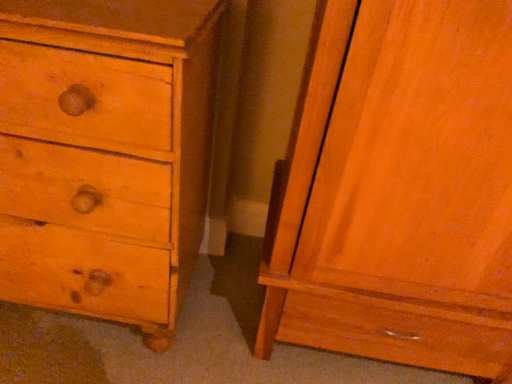
Question: From a real-world perspective, is matte wood cabinet at right positioned above or below matte pine chest of drawers at left?

Choices:
 (A) below
 (B) above

Answer: (B)

Question: From the image's perspective, is matte wood cabinet at right located above or below matte pine chest of drawers at left?

Choices:
 (A) above
 (B) below

Answer: (B)

Question: Is point (409, 200) closer or farther from the camera than point (29, 223)?

Choices:
 (A) closer
 (B) farther

Answer: (A)

Question: Would you say matte pine chest of drawers at left is to the left or to the right of matte wood cabinet at right in the picture?

Choices:
 (A) right
 (B) left

Answer: (B)

Question: From a real-world perspective, is matte pine chest of drawers at left positioned above or below matte wood cabinet at right?

Choices:
 (A) above
 (B) below

Answer: (B)

Question: From the image's perspective, relative to matte wood cabinet at right, is matte pine chest of drawers at left above or below?

Choices:
 (A) below
 (B) above

Answer: (B)

Question: In terms of width, does matte pine chest of drawers at left look wider or thinner when compared to matte wood cabinet at right?

Choices:
 (A) wide
 (B) thin

Answer: (B)